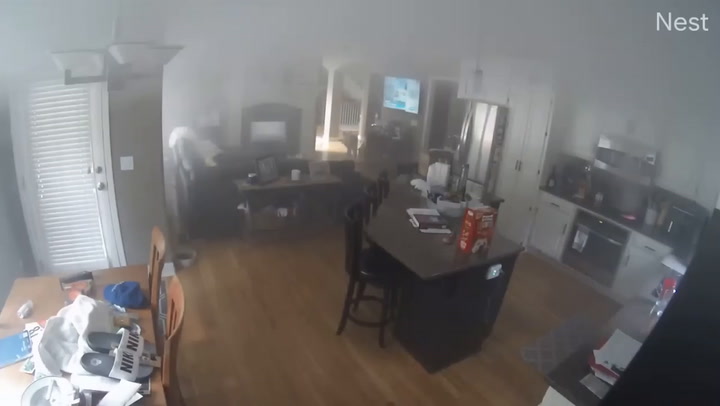
You are a GUI agent. You are given a task and a screenshot of the screen. Output one action in this format:
    pyautogui.click(x=<x>, y=<y>)
    Task: Click on the fireplace
    The width and height of the screenshot is (720, 406).
    Given the screenshot: What is the action you would take?
    pyautogui.click(x=266, y=122)